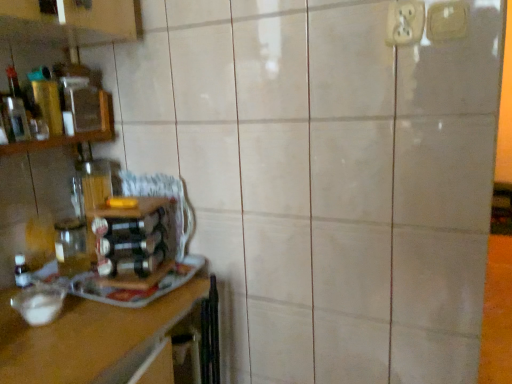
Question: Should I look upward or downward to see wooden shelf at left?

Choices:
 (A) down
 (B) up

Answer: (B)

Question: Is white plastic electric outlet at upper right, the 1th electric outlet from the right, behind white plastic electric outlet at upper right, positioned as the second electric outlet in right-to-left order?

Choices:
 (A) yes
 (B) no

Answer: (B)

Question: Can you confirm if white plastic electric outlet at upper right, the 2th electric outlet from the left, is bigger than white plastic electric outlet at upper right, positioned as the second electric outlet in right-to-left order?

Choices:
 (A) no
 (B) yes

Answer: (A)

Question: From the image's perspective, is white plastic electric outlet at upper right, the 2th electric outlet from the left, below white plastic electric outlet at upper right, which is counted as the 1th electric outlet, starting from the left?

Choices:
 (A) yes
 (B) no

Answer: (A)

Question: Can you see white plastic electric outlet at upper right, the 1th electric outlet from the right, touching white plastic electric outlet at upper right, positioned as the second electric outlet in right-to-left order?

Choices:
 (A) yes
 (B) no

Answer: (A)

Question: Is white plastic electric outlet at upper right, which is counted as the 1th electric outlet, starting from the left, completely or partially inside white plastic electric outlet at upper right, the 1th electric outlet from the right?

Choices:
 (A) yes
 (B) no

Answer: (B)

Question: From the image's perspective, is white plastic electric outlet at upper right, the 1th electric outlet from the right, above white plastic electric outlet at upper right, which is counted as the 1th electric outlet, starting from the left?

Choices:
 (A) no
 (B) yes

Answer: (A)

Question: Is white plastic electric outlet at upper right, the 1th electric outlet from the right, to the right of wooden shelf at left from the viewer's perspective?

Choices:
 (A) yes
 (B) no

Answer: (A)

Question: From the image's perspective, does white plastic electric outlet at upper right, the 2th electric outlet from the left, appear higher than wooden shelf at left?

Choices:
 (A) yes
 (B) no

Answer: (A)

Question: Is white plastic electric outlet at upper right, the 2th electric outlet from the left, closer to camera compared to wooden shelf at left?

Choices:
 (A) no
 (B) yes

Answer: (B)

Question: From the image's perspective, is white plastic electric outlet at upper right, the 2th electric outlet from the left, below wooden shelf at left?

Choices:
 (A) no
 (B) yes

Answer: (A)

Question: From a real-world perspective, is white plastic electric outlet at upper right, the 1th electric outlet from the right, physically above wooden shelf at left?

Choices:
 (A) no
 (B) yes

Answer: (B)

Question: Does white plastic electric outlet at upper right, the 2th electric outlet from the left, contain wooden shelf at left?

Choices:
 (A) no
 (B) yes

Answer: (A)

Question: From a real-world perspective, is translucent glass bottle at left below white plastic electric outlet at upper right, the 2th electric outlet from the left?

Choices:
 (A) no
 (B) yes

Answer: (B)